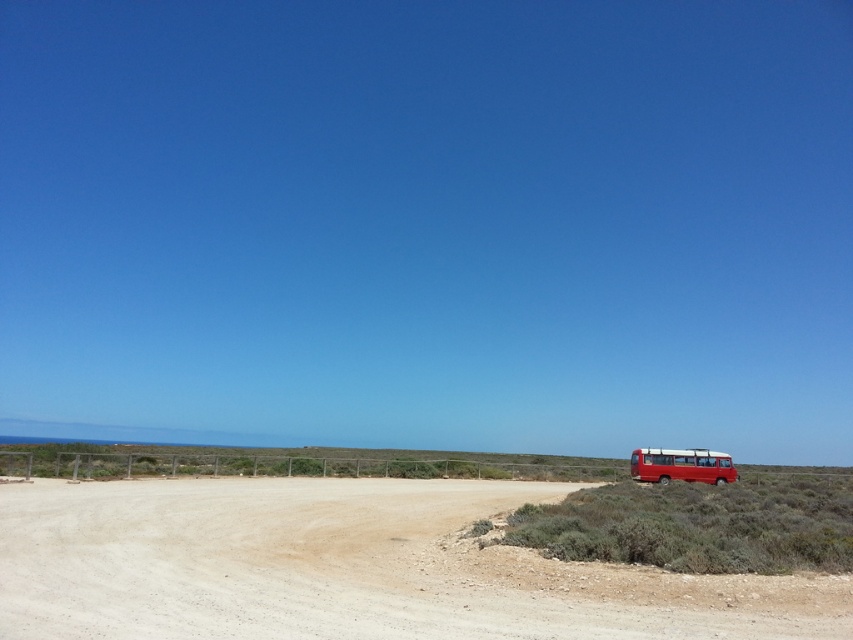
You are standing at the center of the dirt field at lower right and want to see the metallic red bus at right. Can you see the entire bus from your current position?

The dirt field at lower right is not as tall as metallic red bus at right, so yes, you can see the entire bus from your current position because the bus is taller than the field.

You are standing on the dirt field at lower right and want to walk to the metallic red bus at right. Which direction should you head towards?

The dirt field at lower right is closer to the viewer than the metallic red bus at right, so you should head towards the right direction to reach the metallic red bus at right.

You are standing at the center of the dirt road and see the dirt field at lower right and the metallic red bus at right. Which object is positioned to the left of the other?

The dirt field at lower right is to the left of the metallic red bus at right according to the description.